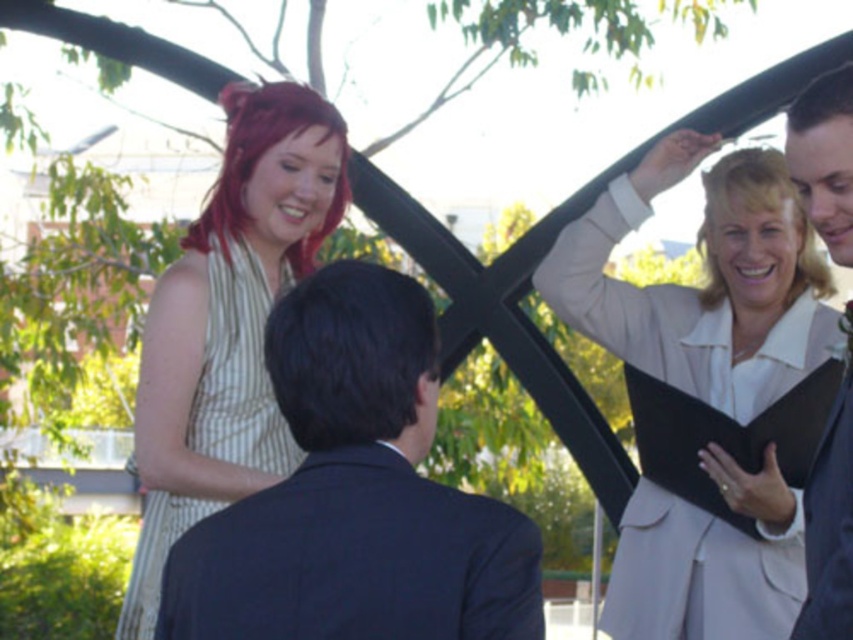
Question: Can you confirm if striped fabric dress at upper left is thinner than dark suit jacket at upper right?

Choices:
 (A) no
 (B) yes

Answer: (A)

Question: Which is farther from the black matte clipboard at upper right?

Choices:
 (A) dark blue suit at center
 (B) dark suit jacket at upper right

Answer: (A)

Question: Can you confirm if beige fabric jacket at upper right is positioned below dark suit jacket at upper right?

Choices:
 (A) no
 (B) yes

Answer: (B)

Question: Is beige fabric jacket at upper right smaller than striped fabric dress at upper left?

Choices:
 (A) no
 (B) yes

Answer: (B)

Question: Which of these objects is positioned farthest from the beige fabric jacket at upper right?

Choices:
 (A) striped fabric dress at upper left
 (B) dark blue suit at center

Answer: (A)

Question: Based on their relative distances, which object is nearer to the beige fabric jacket at upper right?

Choices:
 (A) striped fabric dress at upper left
 (B) dark blue suit at center
 (C) black matte clipboard at upper right

Answer: (C)